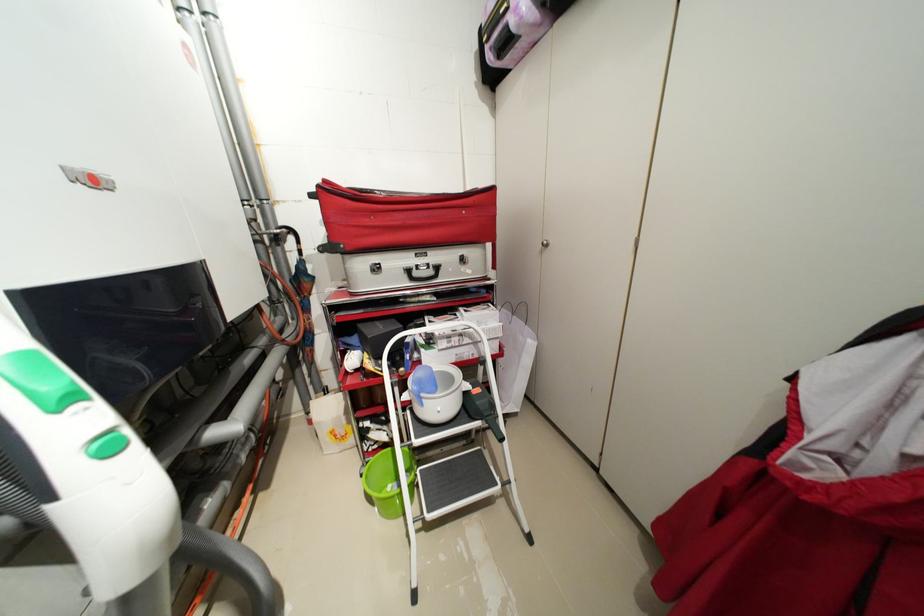
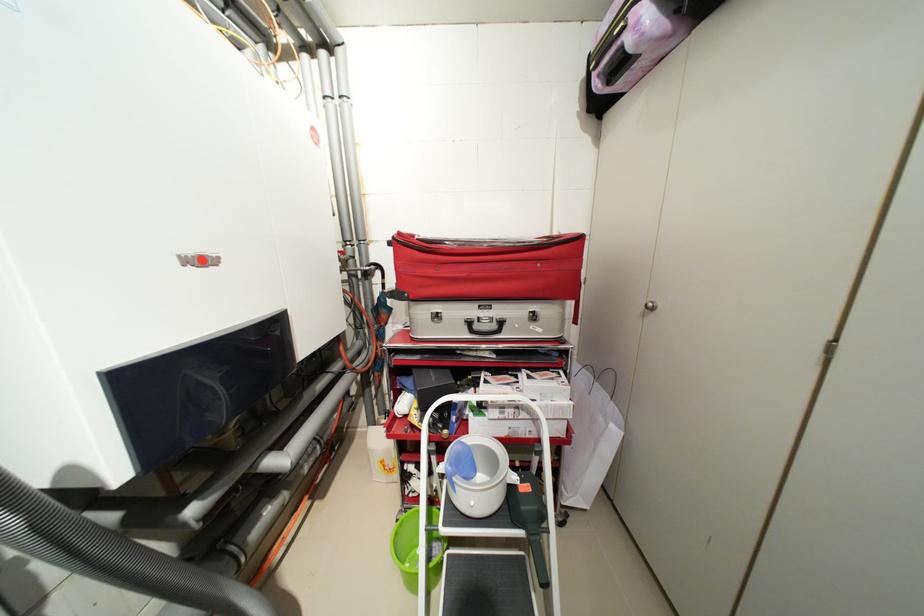
Where in the second image is the point corresponding to (428,400) from the first image?

(459, 485)